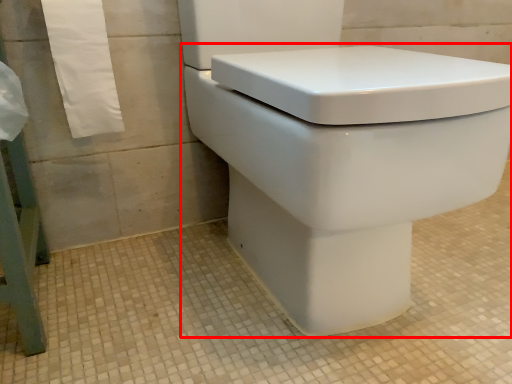
Question: Observing the image, what is the correct spatial positioning of toilet (annotated by the red box) in reference to bath towel?

Choices:
 (A) right
 (B) left

Answer: (A)